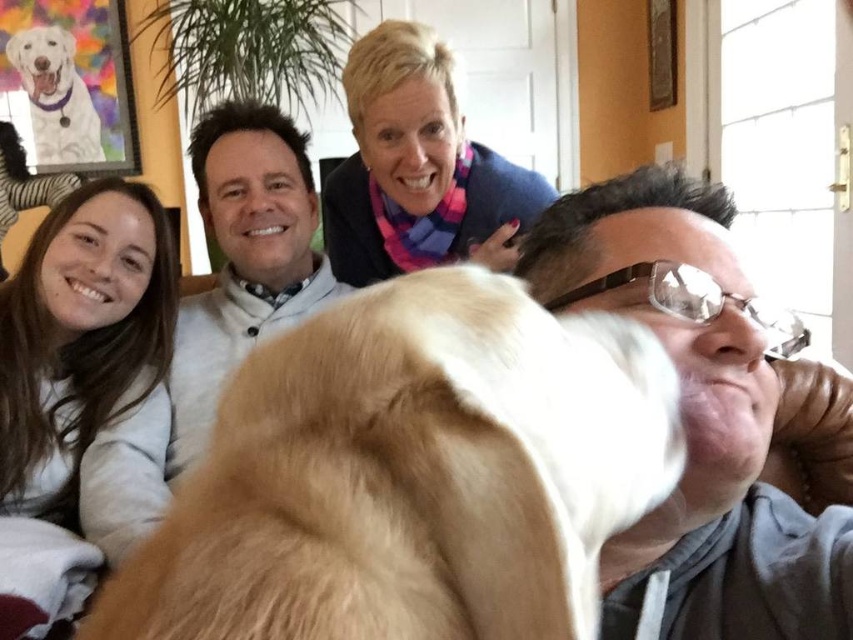
Locate an element on the screen. This screenshot has height=640, width=853. light brown hair at lower left is located at coordinates (73, 380).

Where is `light brown hair at lower left`? light brown hair at lower left is located at coordinates (73, 380).

Is golden fur dog at center to the left of pink fabric scarf at upper center from the viewer's perspective?

In fact, golden fur dog at center is to the right of pink fabric scarf at upper center.

Can you confirm if golden fur dog at center is positioned above pink fabric scarf at upper center?

Actually, golden fur dog at center is below pink fabric scarf at upper center.

Between point (364, 397) and point (405, 241), which one is positioned behind?

Point (405, 241)

I want to click on golden fur dog at center, so click(410, 474).

Is matte brown leather jacket at right smaller than pink fabric scarf at upper center?

Yes, matte brown leather jacket at right is smaller than pink fabric scarf at upper center.

From the picture: Between matte brown leather jacket at right and pink fabric scarf at upper center, which one appears on the left side from the viewer's perspective?

From the viewer's perspective, pink fabric scarf at upper center appears more on the left side.

Which is behind, point (631, 176) or point (421, 259)?

The point (421, 259) is more distant.

You are a GUI agent. You are given a task and a screenshot of the screen. Output one action in this format:
    pyautogui.click(x=<x>, y=<y>)
    Task: Click on the matte brown leather jacket at right
    Image resolution: width=853 pixels, height=640 pixels.
    Given the screenshot: What is the action you would take?
    pyautogui.click(x=697, y=417)